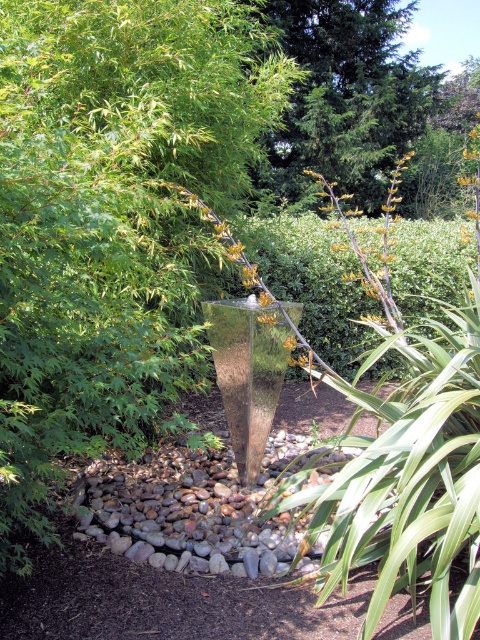
Does green leafy tree at center appear on the left side of green textured tree at upper center?

Correct, you'll find green leafy tree at center to the left of green textured tree at upper center.

Is green leafy tree at center behind green textured tree at upper center?

No, it is not.

Where is `green leafy tree at center`? green leafy tree at center is located at coordinates (113, 220).

How much distance is there between green leafy tree at center and yellow-green textured flower at center?

green leafy tree at center is 4.27 feet away from yellow-green textured flower at center.

Which is behind, point (103, 221) or point (291, 342)?

The point (291, 342) is more distant.

This screenshot has height=640, width=480. What do you see at coordinates (113, 220) in the screenshot?
I see `green leafy tree at center` at bounding box center [113, 220].

This screenshot has height=640, width=480. Find the location of `green leafy tree at center`. green leafy tree at center is located at coordinates (113, 220).

Does green textured tree at upper center lie in front of yellow-green textured flower at center?

No, green textured tree at upper center is behind yellow-green textured flower at center.

Who is taller, green textured tree at upper center or yellow-green textured flower at center?

Standing taller between the two is green textured tree at upper center.

Which is in front, point (350, 186) or point (285, 340)?

Point (285, 340) is in front.

Locate an element on the screen. Image resolution: width=480 pixels, height=640 pixels. green textured tree at upper center is located at coordinates (x=344, y=100).